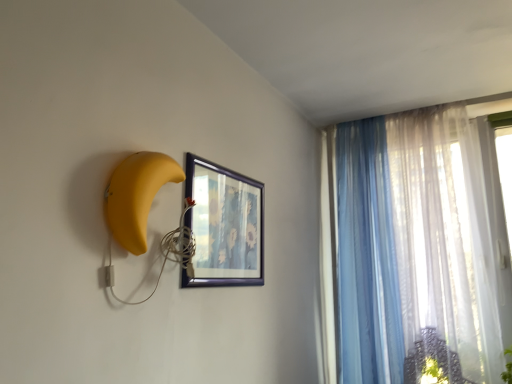
Question: In the image, is wooden framed picture at center on the left side or the right side of translucent fabric curtain at right, which ranks as the 2th curtain in left-to-right order?

Choices:
 (A) right
 (B) left

Answer: (B)

Question: From a real-world perspective, is wooden framed picture at center positioned above or below translucent fabric curtain at right, which ranks as the 2th curtain in left-to-right order?

Choices:
 (A) below
 (B) above

Answer: (A)

Question: Estimate the real-world distances between objects in this image. Which object is farther from the yellow matte banana at left?

Choices:
 (A) translucent blue curtain at upper right, the 1th curtain viewed from the left
 (B) translucent fabric curtain at right, which ranks as the 2th curtain in left-to-right order
 (C) wooden framed picture at center

Answer: (B)

Question: Which object is positioned closest to the yellow matte banana at left?

Choices:
 (A) translucent blue curtain at upper right, the 1th curtain viewed from the left
 (B) wooden framed picture at center
 (C) translucent fabric curtain at right, placed as the 1th curtain when sorted from right to left

Answer: (B)